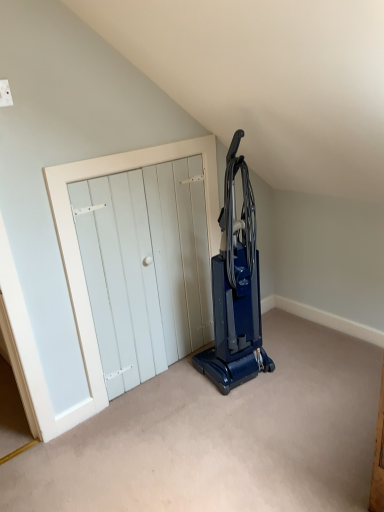
Locate an element on the screen. This screenshot has width=384, height=512. unoccupied region to the right of blue plastic vacuum cleaner at center is located at coordinates (297, 364).